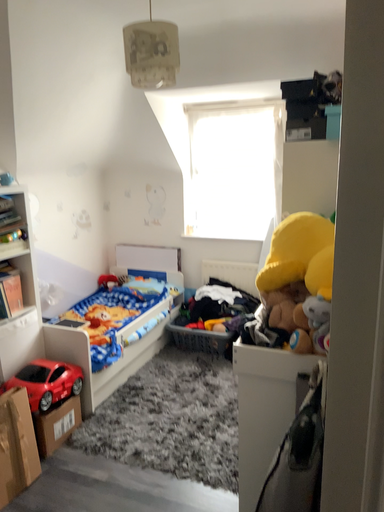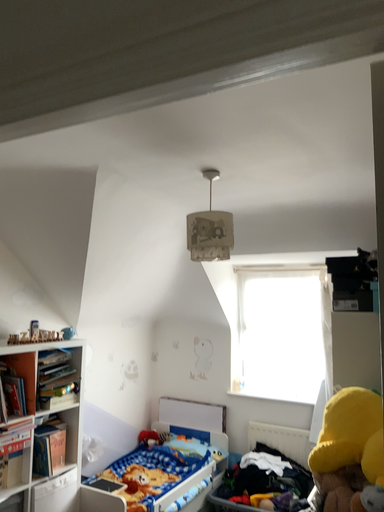
Question: Which way did the camera rotate in the video?

Choices:
 (A) rotated upward
 (B) rotated downward

Answer: (A)